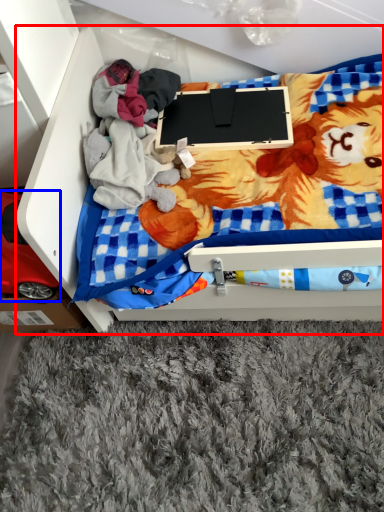
Question: Which point is closer to the camera, furniture (highlighted by a red box) or toy (highlighted by a blue box)?

Choices:
 (A) furniture
 (B) toy

Answer: (A)